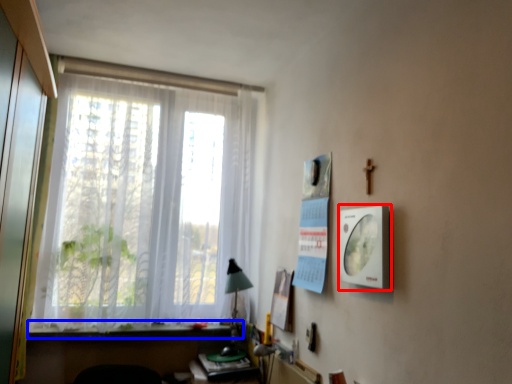
Question: Which point is further to the camera, picture frame (highlighted by a red box) or window sill (highlighted by a blue box)?

Choices:
 (A) picture frame
 (B) window sill

Answer: (B)